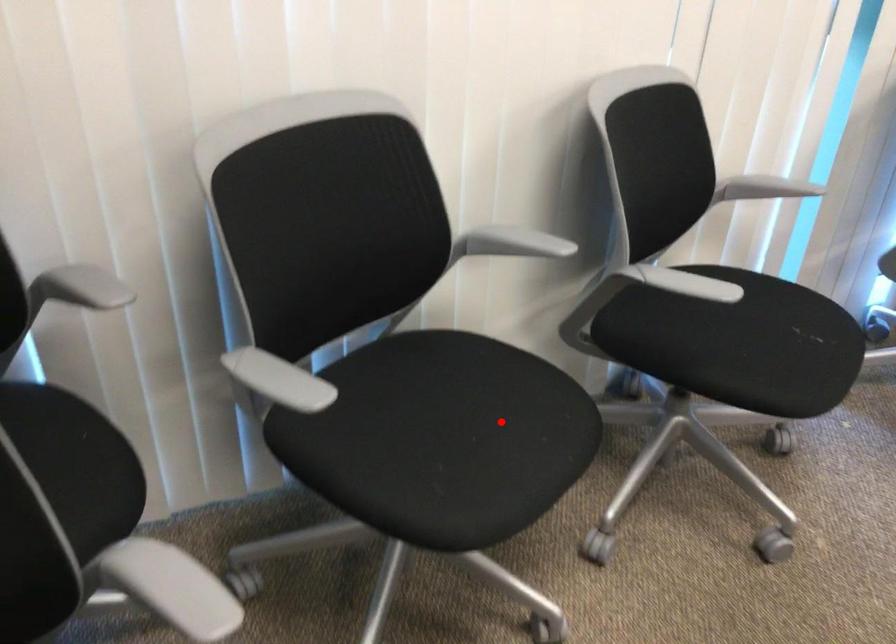
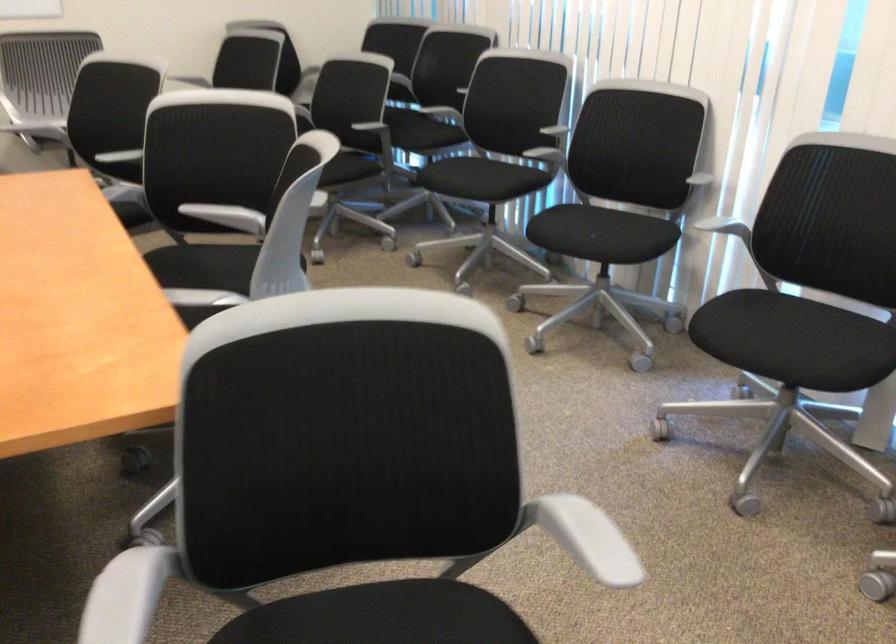
Question: A red point is marked in image1. In image2, is the corresponding 3D point closer to the camera or farther? Reply with the corresponding letter.

Choices:
 (A) The corresponding 3D point is closer.
 (B) The corresponding 3D point is farther.

Answer: (B)